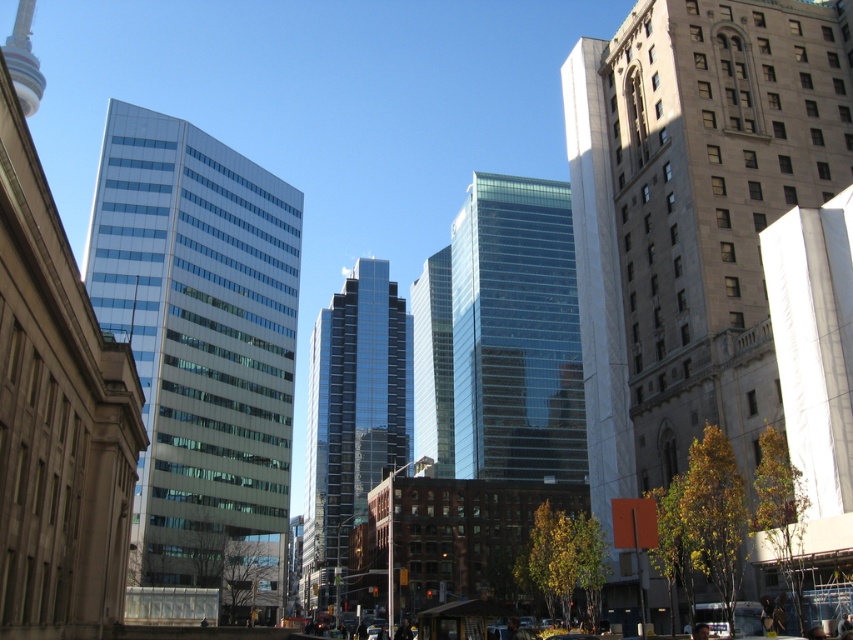
Looking at this image, you are a city planner assessing the skyline. You need to determine which of the two glass structures, the transparent glass building at center or the shiny glass skyscraper at center, would cast a longer shadow during midday. Based on their heights, which one would cast a longer shadow?

The shiny glass skyscraper at center is taller than the transparent glass building at center. Since taller buildings cast longer shadows, the shiny glass skyscraper at center would cast a longer shadow during midday.

You are standing at the center of the image and want to find the matte glass building at left. According to the coordinates provided, in which direction should you look to locate it?

The matte glass building at left is located at coordinates point (201,349), which means it is positioned to the left of the center. Therefore, you should look to the left to locate it.